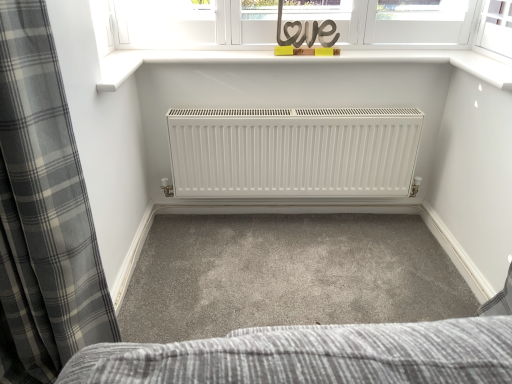
Question: Is gray plaid curtain at left to the left of wooden love sign at upper center from the viewer's perspective?

Choices:
 (A) yes
 (B) no

Answer: (A)

Question: Does gray plaid curtain at left have a greater height compared to wooden love sign at upper center?

Choices:
 (A) yes
 (B) no

Answer: (A)

Question: Can we say gray plaid curtain at left lies outside wooden love sign at upper center?

Choices:
 (A) no
 (B) yes

Answer: (B)

Question: From a real-world perspective, is gray plaid curtain at left on wooden love sign at upper center?

Choices:
 (A) yes
 (B) no

Answer: (B)

Question: Is gray plaid curtain at left directly adjacent to wooden love sign at upper center?

Choices:
 (A) no
 (B) yes

Answer: (A)

Question: From a real-world perspective, is gray plaid curtain at left beneath wooden love sign at upper center?

Choices:
 (A) yes
 (B) no

Answer: (A)

Question: From the image's perspective, is wooden love sign at upper center located beneath gray plaid curtain at left?

Choices:
 (A) yes
 (B) no

Answer: (B)

Question: From the image's perspective, is wooden love sign at upper center located above gray plaid curtain at left?

Choices:
 (A) no
 (B) yes

Answer: (B)

Question: Does wooden love sign at upper center have a greater width compared to gray plaid curtain at left?

Choices:
 (A) yes
 (B) no

Answer: (B)

Question: Considering the relative positions of wooden love sign at upper center and gray plaid curtain at left in the image provided, is wooden love sign at upper center in front of gray plaid curtain at left?

Choices:
 (A) no
 (B) yes

Answer: (A)

Question: Does wooden love sign at upper center touch gray plaid curtain at left?

Choices:
 (A) no
 (B) yes

Answer: (A)

Question: Is wooden love sign at upper center outside gray plaid curtain at left?

Choices:
 (A) yes
 (B) no

Answer: (A)

Question: From a real-world perspective, is gray plaid curtain at left positioned above or below wooden love sign at upper center?

Choices:
 (A) below
 (B) above

Answer: (A)